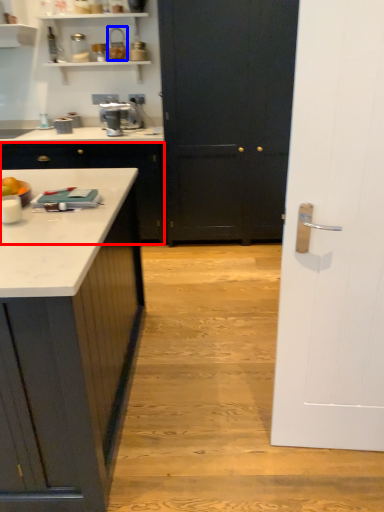
Question: Which point is further to the camera, cabinetry (highlighted by a red box) or appliance (highlighted by a blue box)?

Choices:
 (A) cabinetry
 (B) appliance

Answer: (B)